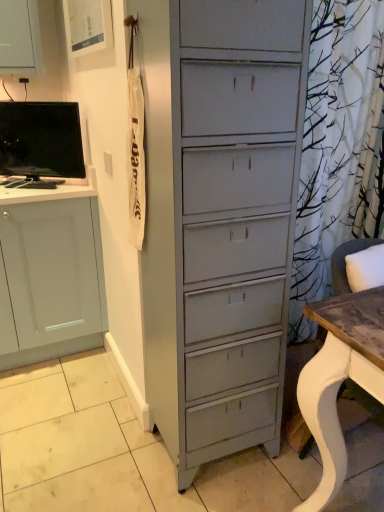
Identify the location of vacant area situated below white wood desk at right (from a real-world perspective). (357, 467).